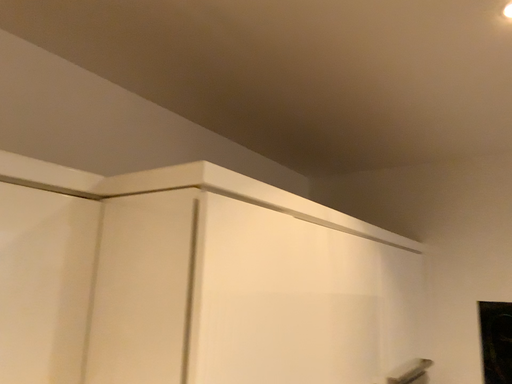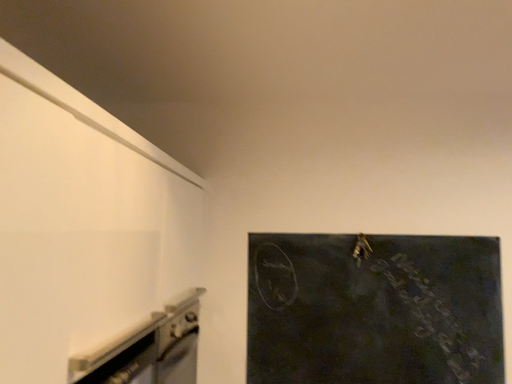
Question: How did the camera likely rotate when shooting the video?

Choices:
 (A) rotated left
 (B) rotated right

Answer: (B)